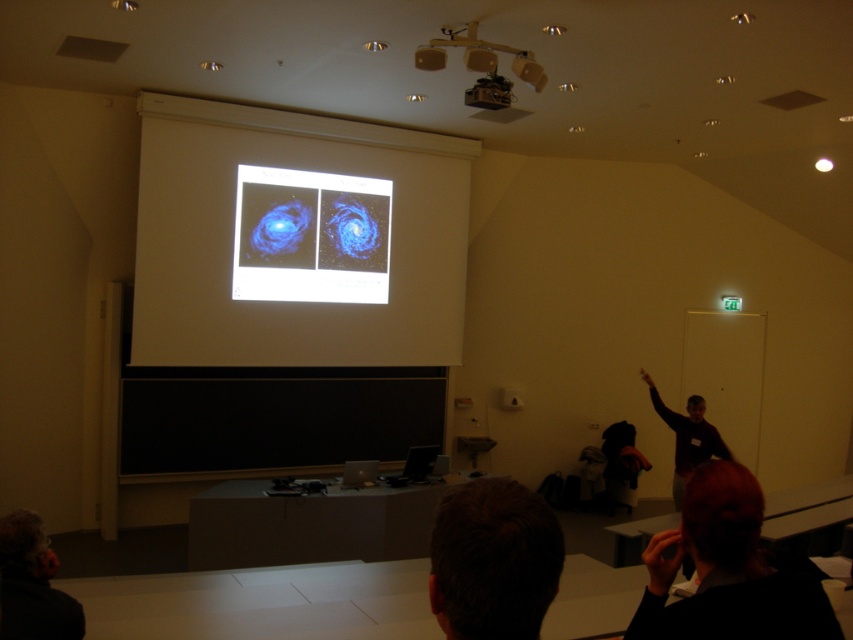
Does white matte projection screen at upper center have a lesser width compared to blue matte galaxy at upper center?

No, white matte projection screen at upper center is not thinner than blue matte galaxy at upper center.

Is point (172, 136) closer to camera compared to point (332, 260)?

Yes, point (172, 136) is closer to viewer.

Does point (259, 353) come in front of point (292, 243)?

Yes.

You are a GUI agent. You are given a task and a screenshot of the screen. Output one action in this format:
    pyautogui.click(x=<x>, y=<y>)
    Task: Click on the white matte projection screen at upper center
    The image size is (853, 640).
    Given the screenshot: What is the action you would take?
    pyautogui.click(x=289, y=301)

Is black matte/blackboard at center below dark hair at lower left?

Yes.

Is black matte/blackboard at center to the right of dark hair at lower left from the viewer's perspective?

No, black matte/blackboard at center is not to the right of dark hair at lower left.

Is point (282, 419) more distant than point (67, 632)?

Yes, point (282, 419) is farther from viewer.

The image size is (853, 640). In order to click on black matte/blackboard at center in this screenshot , I will do `click(274, 417)`.

Does black matte/blackboard at center have a greater height compared to matte black projector at upper center?

Correct, black matte/blackboard at center is much taller as matte black projector at upper center.

Is black matte/blackboard at center shorter than matte black projector at upper center?

No, black matte/blackboard at center is not shorter than matte black projector at upper center.

What are the coordinates of `black matte/blackboard at center` in the screenshot? It's located at (274, 417).